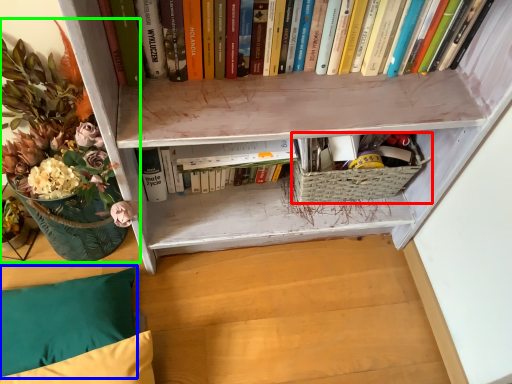
Question: Which object is positioned farthest from basket (highlighted by a red box)? Select from pillow (highlighted by a blue box) and floral arrangement (highlighted by a green box).

Choices:
 (A) pillow
 (B) floral arrangement

Answer: (A)